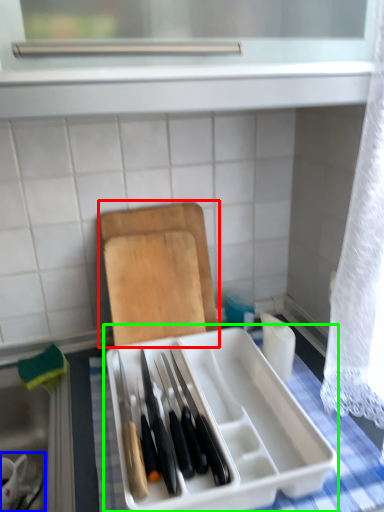
Question: Which is farther away from cutting board (highlighted by a red box)? tableware (highlighted by a blue box) or appliance (highlighted by a green box)?

Choices:
 (A) tableware
 (B) appliance

Answer: (A)